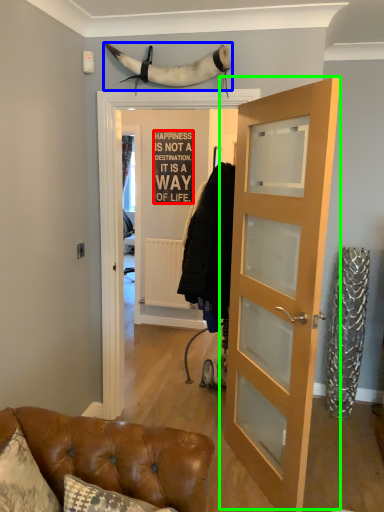
Question: Which object is positioned farthest from writing (highlighted by a red box)? Select from animal (highlighted by a blue box) and door (highlighted by a green box).

Choices:
 (A) animal
 (B) door

Answer: (B)